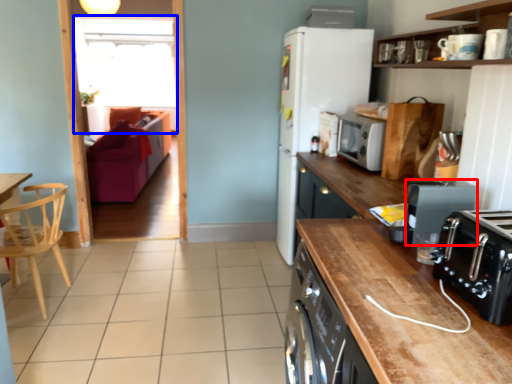
Question: Which point is closer to the camera, kitchen appliance (highlighted by a red box) or window screen (highlighted by a blue box)?

Choices:
 (A) kitchen appliance
 (B) window screen

Answer: (A)